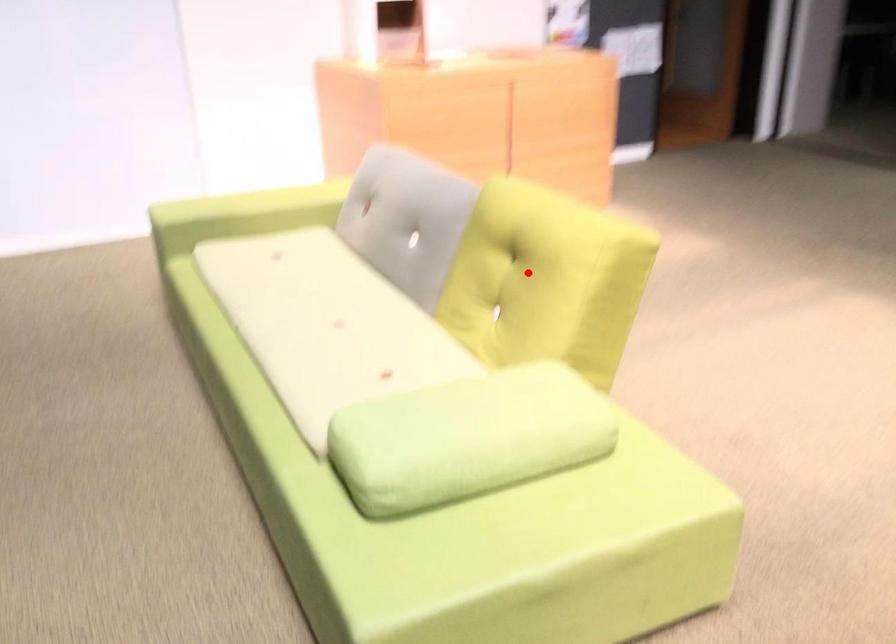
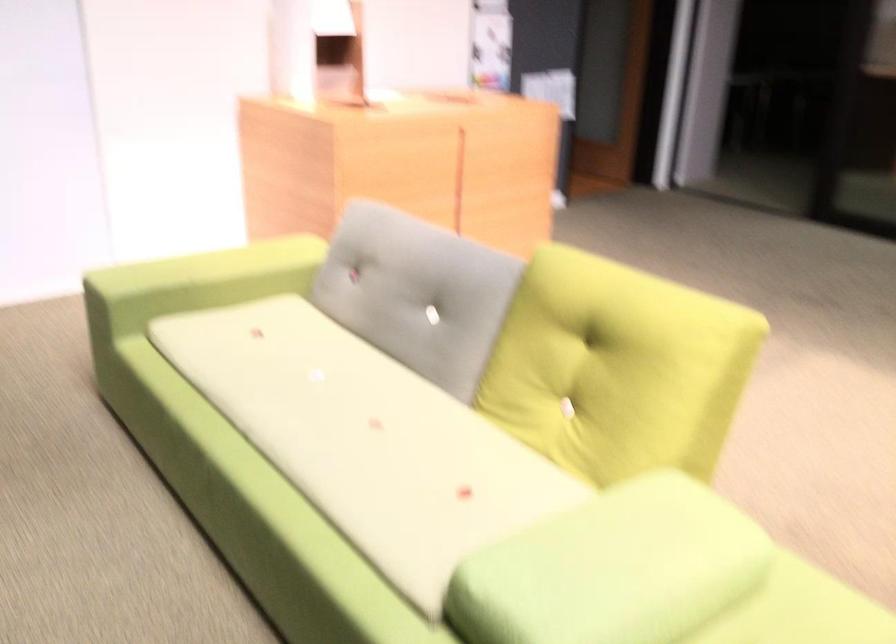
Find the pixel in the second image that matches the highlighted location in the first image.

(616, 368)